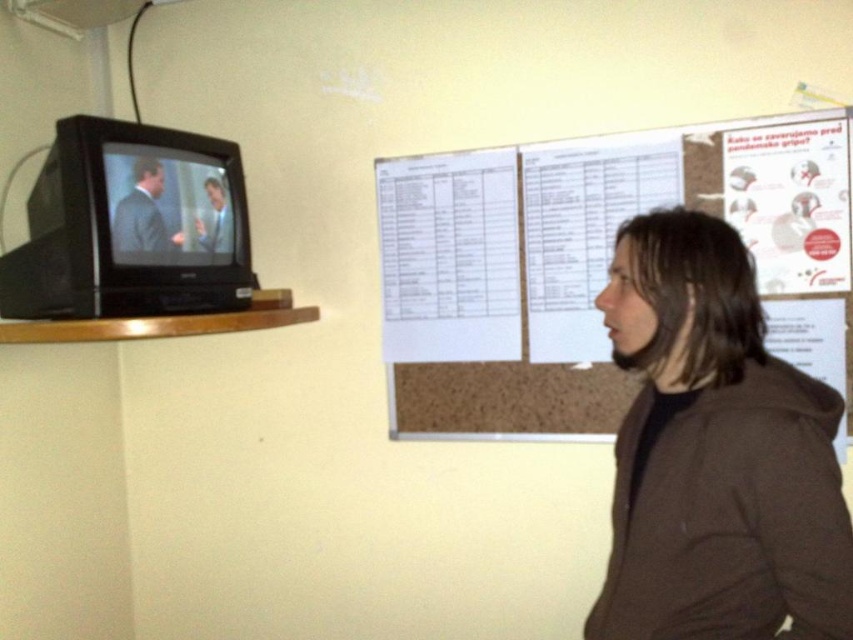
Based on the photo, you are standing in the room and want to hand a document to the smooth skin man at upper left. However, there is a white paper at upper center in the way. Can you move around it to reach the man without disturbing the paper?

The white paper at upper center is positioned on the right side of smooth skin man at upper left, so you can move around to the left side of the white paper at upper center to reach the smooth skin man at upper left without disturbing the paper.

Based on the scene description, where is the white paper at upper center located in terms of coordinates?

The white paper at upper center is located at coordinates point (x=595, y=266).

Looking at this image, based on the scene description, can you determine which object is taller between the white paper at upper center and the smooth skin man at upper left?

The white paper at upper center is taller than the smooth skin man at upper left according to the description.